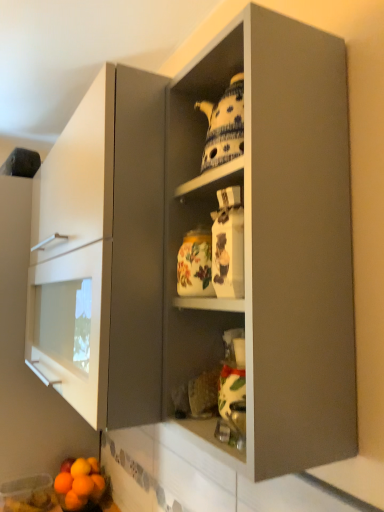
Question: From the image's perspective, is matte gray cabinet at center on top of orange matte at lower left, which is the 4th orange in left-to-right order?

Choices:
 (A) no
 (B) yes

Answer: (B)

Question: Is matte gray cabinet at center far away from orange matte at lower left, which is the second orange in right-to-left order?

Choices:
 (A) yes
 (B) no

Answer: (A)

Question: Is matte gray cabinet at center directly adjacent to orange matte at lower left, which is the second orange in right-to-left order?

Choices:
 (A) yes
 (B) no

Answer: (B)

Question: Does matte gray cabinet at center lie in front of orange matte at lower left, which is the 4th orange in left-to-right order?

Choices:
 (A) yes
 (B) no

Answer: (A)

Question: Does matte gray cabinet at center have a lesser height compared to orange matte at lower left, which is the 4th orange in left-to-right order?

Choices:
 (A) no
 (B) yes

Answer: (A)

Question: Considering the positions of point (82, 501) and point (67, 496), is point (82, 501) closer or farther from the camera than point (67, 496)?

Choices:
 (A) closer
 (B) farther

Answer: (B)

Question: Based on their positions, is orange matte at lower left, the 2th orange viewed from the left, located to the left or right of smooth orange grapefruit at lower left?

Choices:
 (A) left
 (B) right

Answer: (A)

Question: Relative to smooth orange grapefruit at lower left, is orange matte at lower left, the 4th orange when ordered from right to left, in front or behind?

Choices:
 (A) front
 (B) behind

Answer: (B)

Question: In terms of height, does orange matte at lower left, the 2th orange viewed from the left, look taller or shorter compared to smooth orange grapefruit at lower left?

Choices:
 (A) short
 (B) tall

Answer: (B)

Question: Is porcelain teapot at upper center inside the boundaries of smooth orange grapefruit at lower left, or outside?

Choices:
 (A) inside
 (B) outside

Answer: (B)

Question: Considering the relative positions of porcelain teapot at upper center and smooth orange grapefruit at lower left in the image provided, is porcelain teapot at upper center to the left or to the right of smooth orange grapefruit at lower left?

Choices:
 (A) right
 (B) left

Answer: (A)

Question: In terms of height, does porcelain teapot at upper center look taller or shorter compared to smooth orange grapefruit at lower left?

Choices:
 (A) short
 (B) tall

Answer: (B)

Question: Relative to smooth orange grapefruit at lower left, is porcelain teapot at upper center in front or behind?

Choices:
 (A) front
 (B) behind

Answer: (A)

Question: Considering their positions, is orange matte at lower left, which ranks as the fifth orange in right-to-left order, located in front of or behind orange matte at lower left, the fifth orange from the left?

Choices:
 (A) front
 (B) behind

Answer: (A)

Question: In terms of width, does orange matte at lower left, the 1th orange viewed from the left, look wider or thinner when compared to orange matte at lower left, the fifth orange from the left?

Choices:
 (A) wide
 (B) thin

Answer: (A)